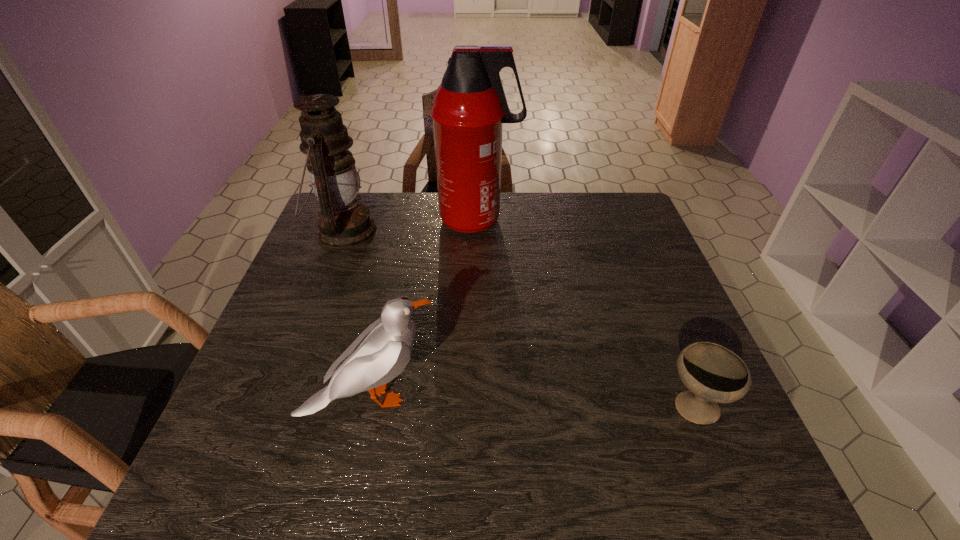
I want to click on fire extinguisher, so click(469, 107).

Find the location of a particular element. the third shortest object is located at coordinates (343, 223).

This screenshot has width=960, height=540. Identify the location of the third tallest object. (381, 352).

At what (x,y) coordinates should I click in order to perform the action: click on the rightmost object. Please return your answer as a coordinate pair (x, y). This screenshot has width=960, height=540. Looking at the image, I should click on pyautogui.click(x=713, y=374).

This screenshot has width=960, height=540. Identify the location of the shortest object. (713, 374).

Locate an element on the screen. This screenshot has height=540, width=960. free space located 0.300m on the trigger side of the fire extinguisher is located at coordinates (613, 220).

Locate an element on the screen. This screenshot has height=540, width=960. free space located on the right of the lantern is located at coordinates (468, 231).

Where is `vacant space situated at the beak of the gull`? vacant space situated at the beak of the gull is located at coordinates (517, 397).

The height and width of the screenshot is (540, 960). Find the location of `free space located 0.400m on the back of the shortest object`. free space located 0.400m on the back of the shortest object is located at coordinates (634, 261).

The width and height of the screenshot is (960, 540). What are the coordinates of `fire extinguisher at the far edge` in the screenshot? It's located at (469, 107).